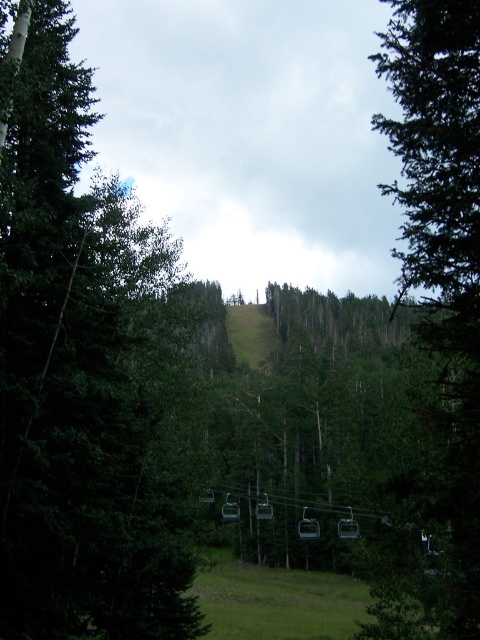
Does green matte tree at left appear on the left side of green grassy ski slope at center?

Correct, you'll find green matte tree at left to the left of green grassy ski slope at center.

Is point (123, 371) positioned before point (227, 316)?

Yes, it is.

Where is `green matte tree at left`? green matte tree at left is located at coordinates (86, 380).

Based on the photo, who is higher up, green matte tree at left or green matte tree at center?

green matte tree at center is higher up.

Does green matte tree at left appear over green matte tree at center?

Incorrect, green matte tree at left is not positioned above green matte tree at center.

What do you see at coordinates (86, 380) in the screenshot?
I see `green matte tree at left` at bounding box center [86, 380].

Where is `green matte tree at left`? The width and height of the screenshot is (480, 640). green matte tree at left is located at coordinates (86, 380).

From the picture: Is green matte tree at center further to camera compared to green grassy ski slope at center?

No.

Who is shorter, green matte tree at center or green grassy ski slope at center?

green grassy ski slope at center is shorter.

Describe the element at coordinates (442, 262) in the screenshot. I see `green matte tree at center` at that location.

Image resolution: width=480 pixels, height=640 pixels. I want to click on green matte tree at center, so click(442, 262).